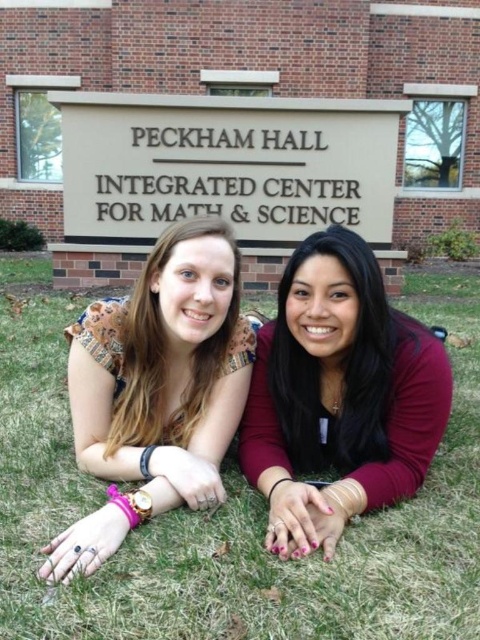
You are a photographer trying to capture a closeup shot of both the maroon fabric shirt at center and the multicolored fabric blouse at center. Given that your camera lens has a maximum focus range of 15 inches, will you be able to focus on both subjects simultaneously?

The maroon fabric shirt at center and multicolored fabric blouse at center are 17.30 inches apart from each other. Since the distance between them exceeds the camera lens maximum focus range of 15 inches, you will not be able to focus on both subjects simultaneously.